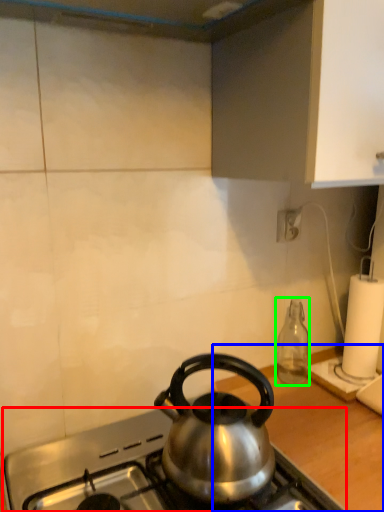
Question: Considering the real-world distances, which object is closest to gas stove (highlighted by a red box)? counter top (highlighted by a blue box) or bottle (highlighted by a green box).

Choices:
 (A) counter top
 (B) bottle

Answer: (A)